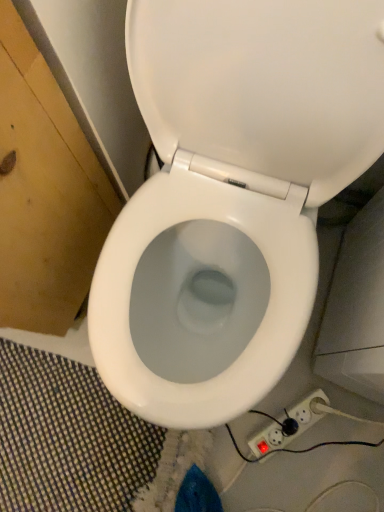
Question: From a real-world perspective, relative to white glossy toilet at center, is white plastic power strip at lower right vertically above or below?

Choices:
 (A) below
 (B) above

Answer: (A)

Question: In terms of size, does white plastic power strip at lower right appear bigger or smaller than white glossy toilet at center?

Choices:
 (A) big
 (B) small

Answer: (B)

Question: From the image's perspective, is white plastic power strip at lower right located above or below white glossy toilet at center?

Choices:
 (A) below
 (B) above

Answer: (A)

Question: From their relative heights in the image, would you say white glossy toilet at center is taller or shorter than white plastic power strip at lower right?

Choices:
 (A) short
 (B) tall

Answer: (B)

Question: Is white glossy toilet at center wider or thinner than white plastic power strip at lower right?

Choices:
 (A) thin
 (B) wide

Answer: (B)

Question: In the image, is white glossy toilet at center positioned in front of or behind white plastic power strip at lower right?

Choices:
 (A) behind
 (B) front

Answer: (B)

Question: Would you say white glossy toilet at center is to the left or to the right of white plastic power strip at lower right in the picture?

Choices:
 (A) right
 (B) left

Answer: (B)